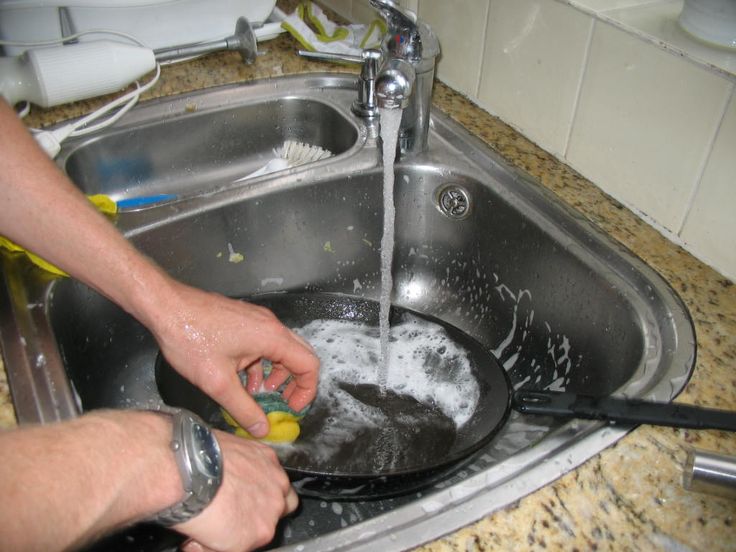
Where is `handle`? The image size is (736, 552). handle is located at coordinates (587, 398), (706, 469).